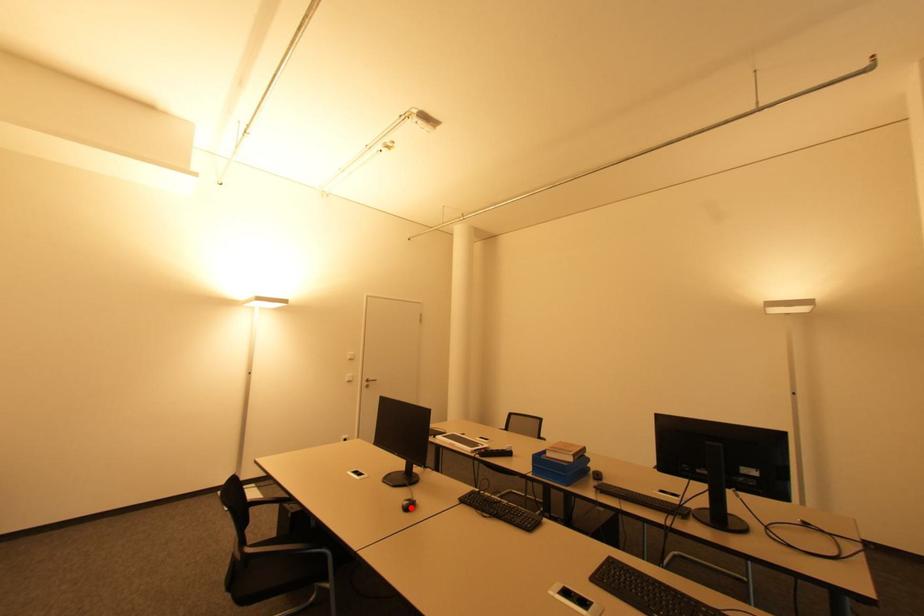
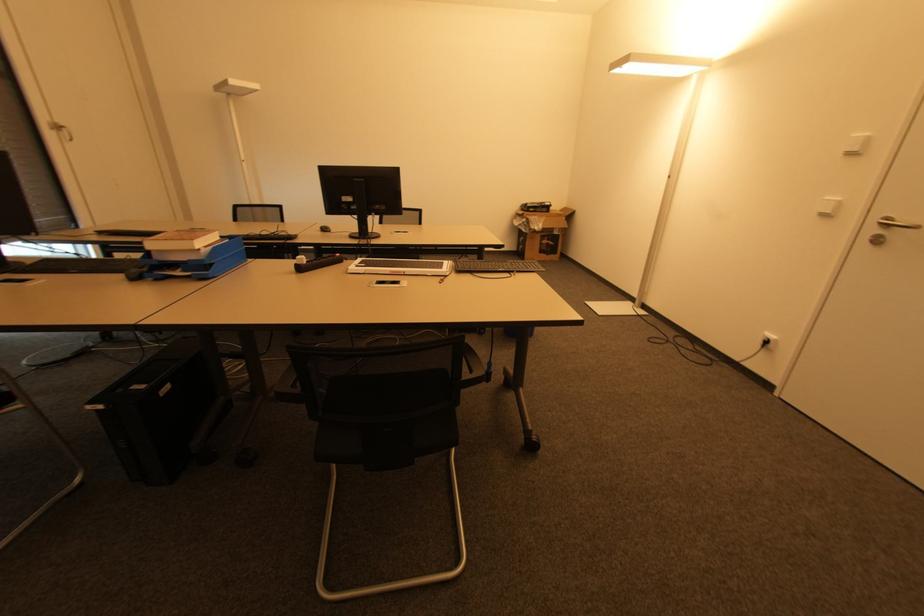
Find the pixel in the second image that matches the highlighted location in the first image.

(325, 230)